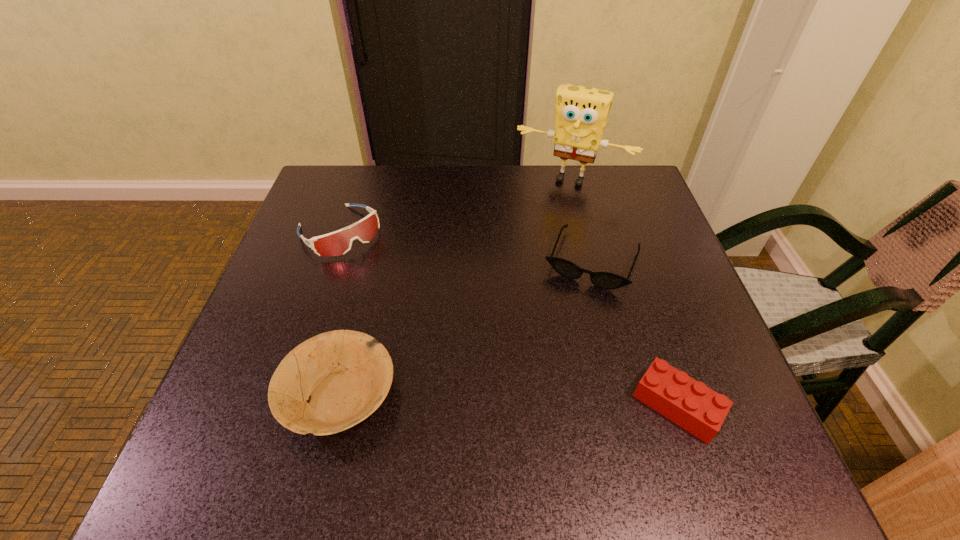
Find the location of a particular element. Lego at the near edge is located at coordinates (692, 405).

You are a GUI agent. You are given a task and a screenshot of the screen. Output one action in this format:
    pyautogui.click(x=<x>, y=<y>)
    Task: Click on the bowl situated at the left edge
    This screenshot has width=960, height=540.
    Given the screenshot: What is the action you would take?
    pyautogui.click(x=345, y=375)

Identify the location of goggles present at the left edge. (339, 243).

Identify the location of Lego that is positioned at the right edge. (692, 405).

Where is `sunglasses that is at the right edge`? This screenshot has height=540, width=960. sunglasses that is at the right edge is located at coordinates (605, 280).

Locate an element on the screen. sponge positioned at the right edge is located at coordinates (581, 115).

Locate an element on the screen. The height and width of the screenshot is (540, 960). object that is at the far left corner is located at coordinates (339, 243).

Where is `object present at the near left corner`? object present at the near left corner is located at coordinates (345, 375).

What are the coordinates of `object at the far right corner` in the screenshot? It's located at (581, 115).

Where is `object that is at the near right corner`? object that is at the near right corner is located at coordinates (692, 405).